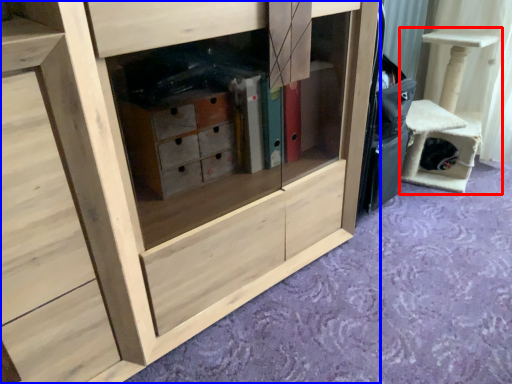
Question: Which point is further to the camera, furniture (highlighted by a red box) or cabinetry (highlighted by a blue box)?

Choices:
 (A) furniture
 (B) cabinetry

Answer: (A)